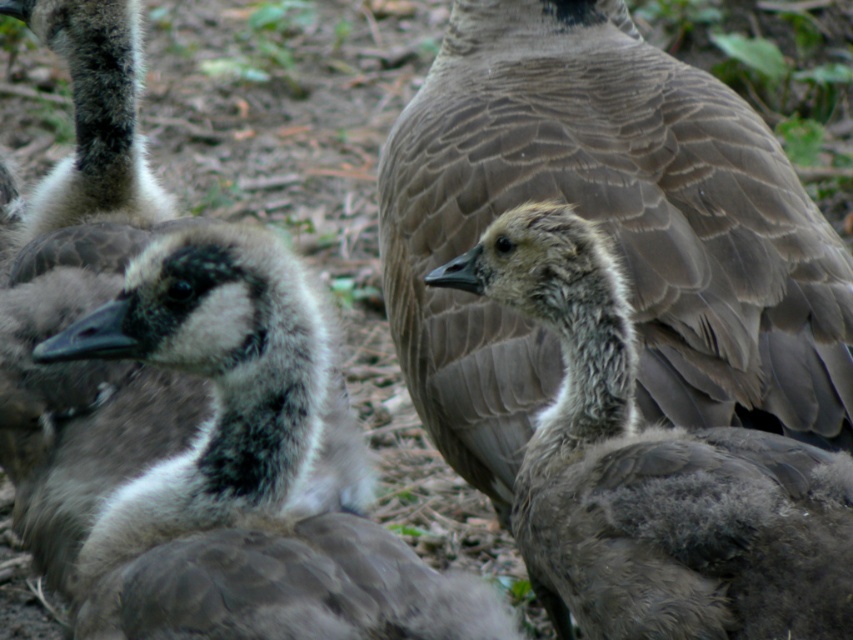
You are a wildlife photographer trying to capture a closeup of the gray downy feathers at center. Based on the coordinates provided, where should you position your camera relative to the goslings?

The gray downy feathers at center are located at coordinates point (x=608, y=234), so you should position your camera slightly to the right and lower down to focus on that specific area.

You are a wildlife photographer observing Canada geese and their goslings. You notice a gray downy feathers at center and a dark gray fluffy duckling at left in the scene. Which gosling is positioned to the left in the image?

The dark gray fluffy duckling at left is positioned to the left in the image.

You are a wildlife photographer trying to capture a photo of the dark gray fluffy duckling at left and the gray downy duckling at center. Based on their sizes, which duckling should you focus on to ensure it fills more of the frame without moving the camera?

The dark gray fluffy duckling at left is larger in size compared to the gray downy duckling at center, so focusing on it will fill the frame more without moving the camera.